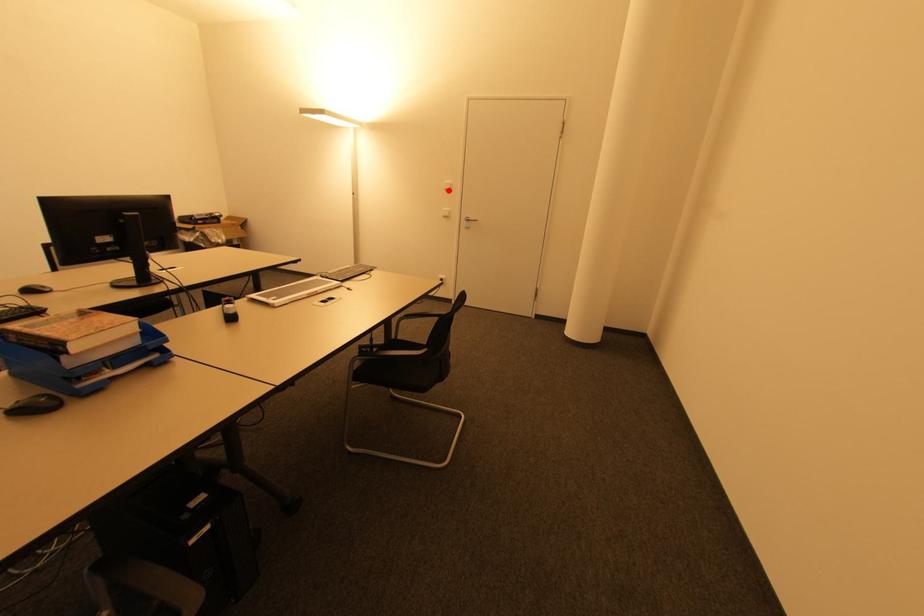
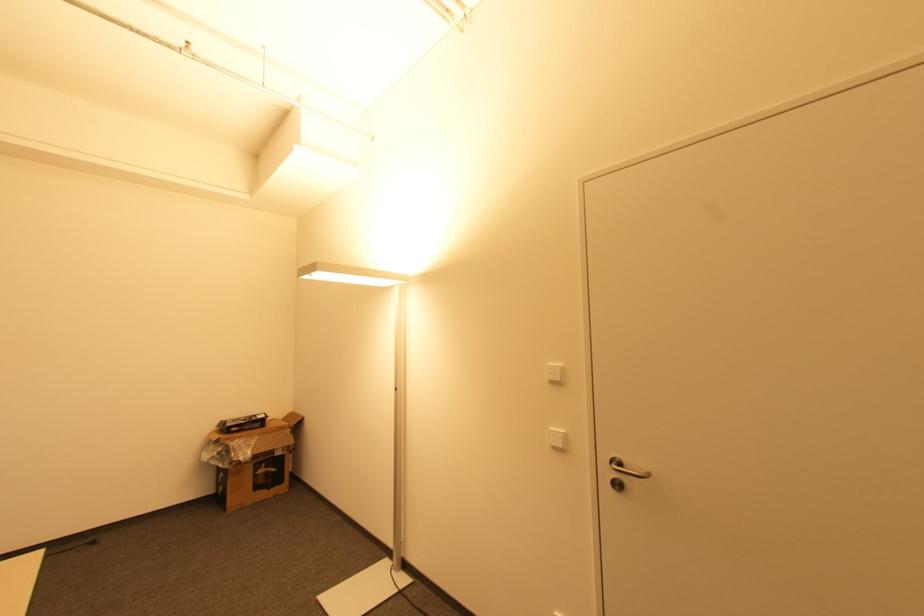
Locate, in the second image, the point that corresponds to the highlighted location in the first image.

(554, 383)